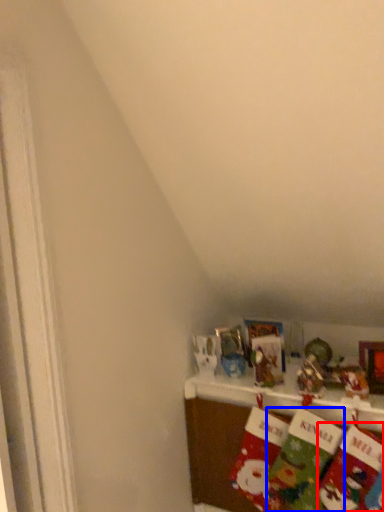
Question: Which point is closer to the camera, sock (highlighted by a red box) or sock (highlighted by a blue box)?

Choices:
 (A) sock
 (B) sock

Answer: (A)